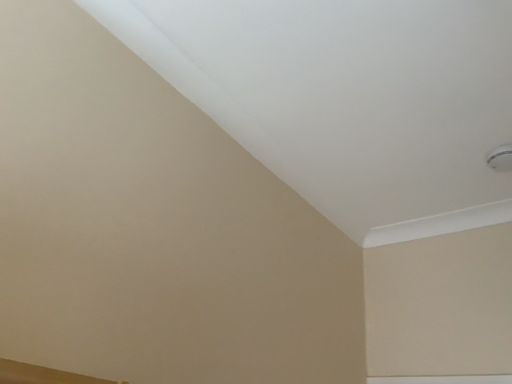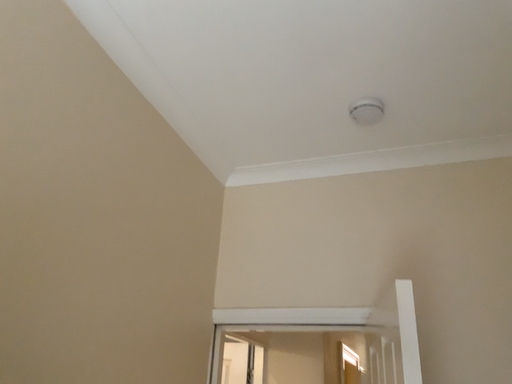
Question: Which way did the camera rotate in the video?

Choices:
 (A) rotated downward
 (B) rotated upward

Answer: (A)